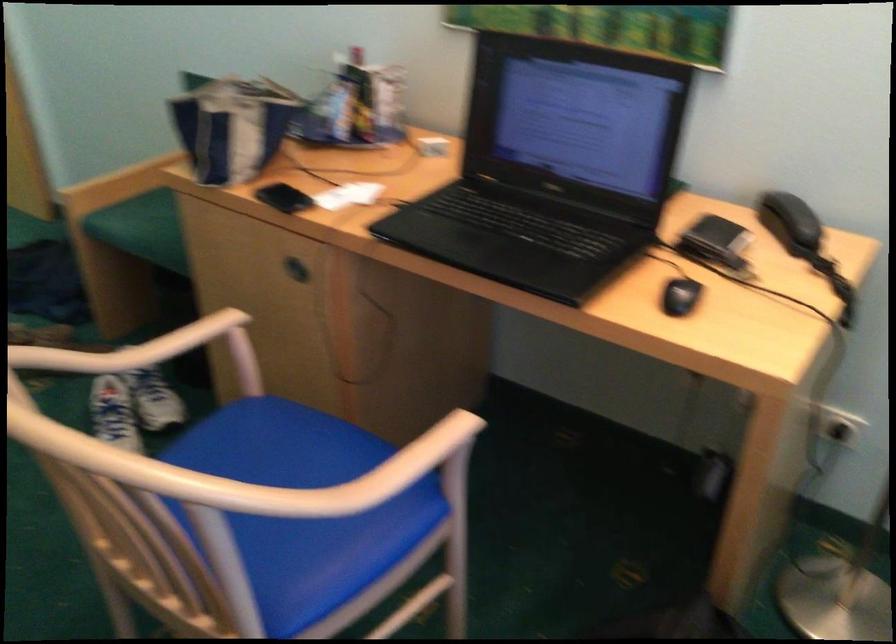
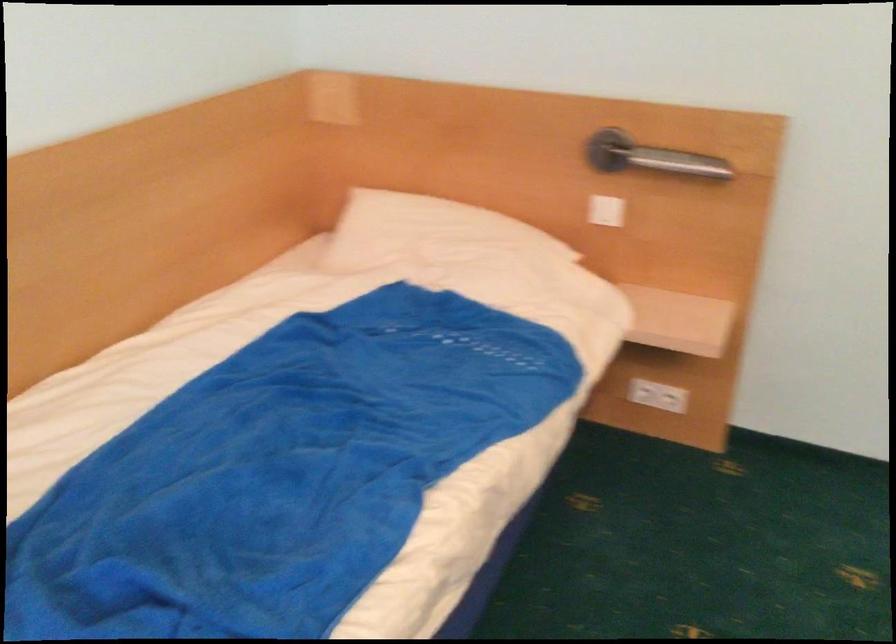
In the scene shown: Based on the continuous images, in which direction is the camera rotating?

The rotation direction of the camera is left-down.